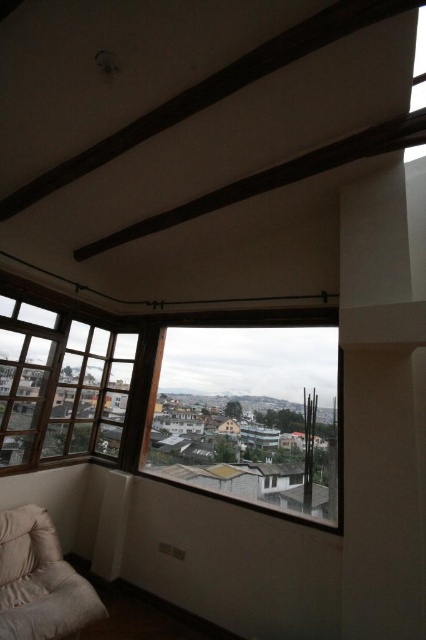
You are sitting on the white soft pillow at lower left and want to look outside. Can you see the clear glass window at left from your current position?

Yes, the clear glass window at left is above the white soft pillow at lower left, so you can see it by looking upward.